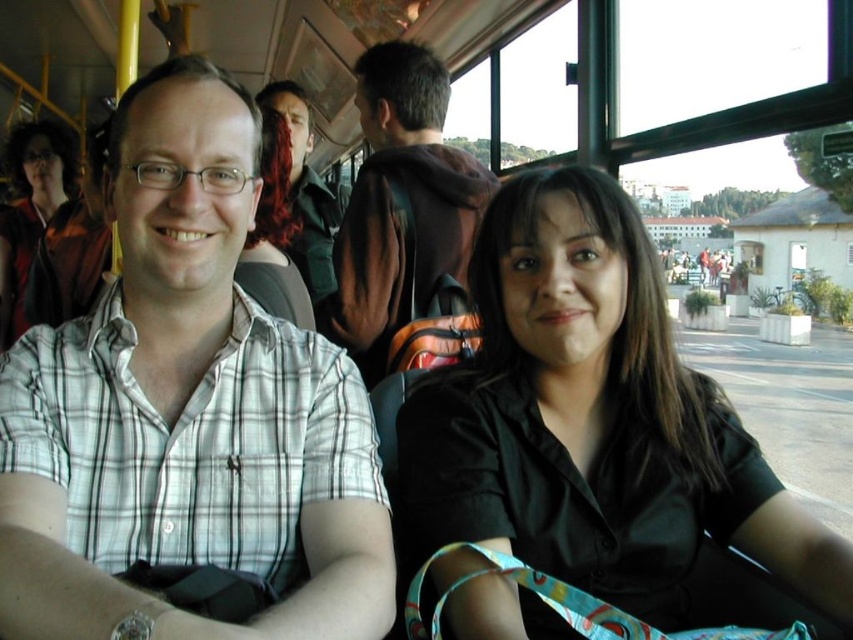
Question: Which point appears farthest from the camera in this image?

Choices:
 (A) (297, 168)
 (B) (337, 481)
 (C) (28, 202)

Answer: (C)

Question: Which object is farther from the camera taking this photo?

Choices:
 (A) green military vest at center
 (B) matte black jacket at upper left
 (C) black matte shirt at center

Answer: (B)

Question: Is white checkered shirt at center smaller than green military vest at center?

Choices:
 (A) no
 (B) yes

Answer: (B)

Question: From the image, what is the correct spatial relationship of white checkered shirt at center in relation to black matte shirt at center?

Choices:
 (A) below
 (B) above

Answer: (B)

Question: Which point is farther to the camera?

Choices:
 (A) black matte shirt at center
 (B) white checkered shirt at center
 (C) brown suede jacket at center
 (D) matte black jacket at upper left

Answer: (D)

Question: Is black matte shirt at center in front of matte black jacket at upper left?

Choices:
 (A) no
 (B) yes

Answer: (B)